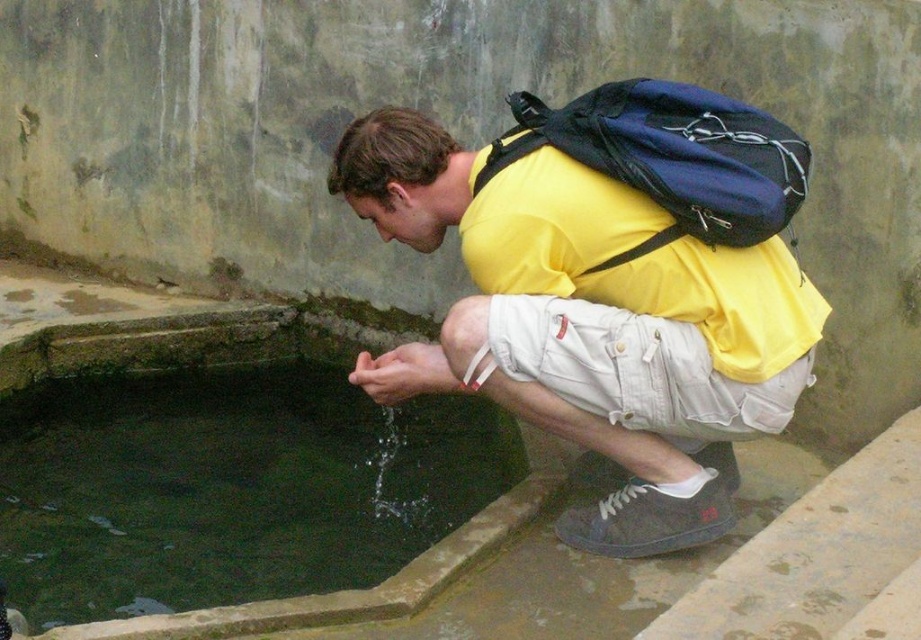
Between green stone pool at lower left and white denim shorts at lower center, which one appears on the left side from the viewer's perspective?

green stone pool at lower left

Can you confirm if green stone pool at lower left is smaller than white denim shorts at lower center?

Incorrect, green stone pool at lower left is not smaller in size than white denim shorts at lower center.

Which is behind, point (195, 518) or point (772, 404)?

The point (195, 518) is more distant.

You are a GUI agent. You are given a task and a screenshot of the screen. Output one action in this format:
    pyautogui.click(x=<x>, y=<y>)
    Task: Click on the green stone pool at lower left
    The image size is (921, 640).
    Given the screenshot: What is the action you would take?
    click(x=227, y=486)

Which of these two, yellow matte shirt at center or green stone pool at lower left, stands shorter?

Standing shorter between the two is green stone pool at lower left.

The width and height of the screenshot is (921, 640). Describe the element at coordinates (589, 321) in the screenshot. I see `yellow matte shirt at center` at that location.

Describe the element at coordinates (589, 321) in the screenshot. The height and width of the screenshot is (640, 921). I see `yellow matte shirt at center` at that location.

You are a GUI agent. You are given a task and a screenshot of the screen. Output one action in this format:
    pyautogui.click(x=<x>, y=<y>)
    Task: Click on the yellow matte shirt at center
    Image resolution: width=921 pixels, height=640 pixels.
    Given the screenshot: What is the action you would take?
    pyautogui.click(x=589, y=321)

Who is positioned more to the left, yellow matte shirt at center or blue fabric backpack at upper center?

yellow matte shirt at center is more to the left.

Which is below, yellow matte shirt at center or blue fabric backpack at upper center?

yellow matte shirt at center is lower down.

Identify the location of yellow matte shirt at center. This screenshot has width=921, height=640. (589, 321).